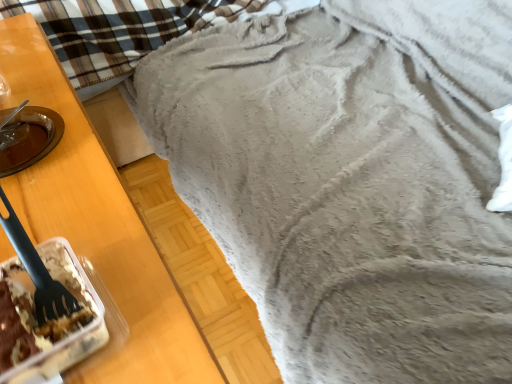
Question: Can you confirm if black plastic fork at left is positioned to the left of translucent plastic container with cake at lower left?

Choices:
 (A) no
 (B) yes

Answer: (B)

Question: From the image's perspective, is black plastic fork at left over translucent plastic container with cake at lower left?

Choices:
 (A) no
 (B) yes

Answer: (B)

Question: From a real-world perspective, is black plastic fork at left positioned under translucent plastic container with cake at lower left based on gravity?

Choices:
 (A) no
 (B) yes

Answer: (A)

Question: Is black plastic fork at left located outside translucent plastic container with cake at lower left?

Choices:
 (A) no
 (B) yes

Answer: (B)

Question: Can you confirm if black plastic fork at left is bigger than translucent plastic container with cake at lower left?

Choices:
 (A) yes
 (B) no

Answer: (B)

Question: Is black plastic fork at left looking in the opposite direction of translucent plastic container with cake at lower left?

Choices:
 (A) no
 (B) yes

Answer: (A)

Question: From a real-world perspective, is fuzzy gray blanket at upper right physically above black plastic fork at left?

Choices:
 (A) yes
 (B) no

Answer: (B)

Question: Is fuzzy gray blanket at upper right wider than black plastic fork at left?

Choices:
 (A) yes
 (B) no

Answer: (A)

Question: From a real-world perspective, does fuzzy gray blanket at upper right sit lower than black plastic fork at left?

Choices:
 (A) no
 (B) yes

Answer: (B)

Question: Is fuzzy gray blanket at upper right facing towards black plastic fork at left?

Choices:
 (A) no
 (B) yes

Answer: (A)

Question: Considering the relative sizes of fuzzy gray blanket at upper right and black plastic fork at left in the image provided, is fuzzy gray blanket at upper right thinner than black plastic fork at left?

Choices:
 (A) no
 (B) yes

Answer: (A)

Question: From the image's perspective, is fuzzy gray blanket at upper right under black plastic fork at left?

Choices:
 (A) yes
 (B) no

Answer: (A)

Question: From a real-world perspective, does fuzzy gray blanket at upper right sit lower than translucent plastic container with cake at lower left?

Choices:
 (A) no
 (B) yes

Answer: (B)